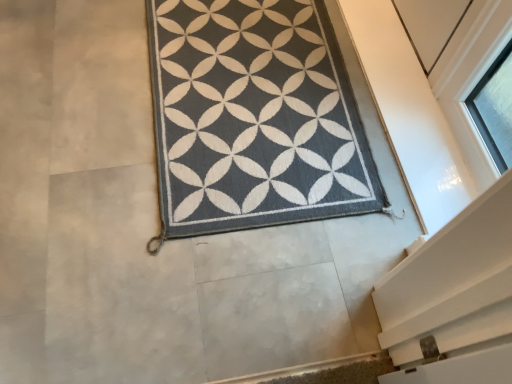
This screenshot has width=512, height=384. In order to click on free space to the left of dark gray textured rug at center in this screenshot , I will do `click(77, 95)`.